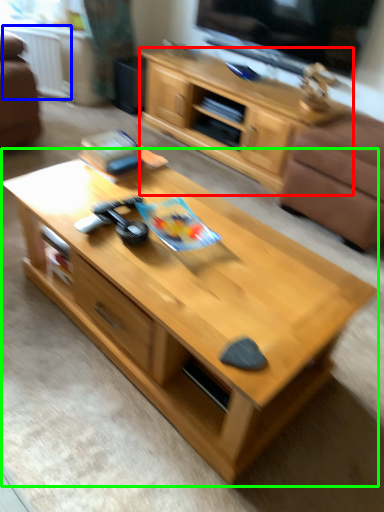
Question: Which object is positioned farthest from cabinetry (highlighted by a red box)? Select from radiator (highlighted by a blue box) and coffee table (highlighted by a green box).

Choices:
 (A) radiator
 (B) coffee table

Answer: (B)